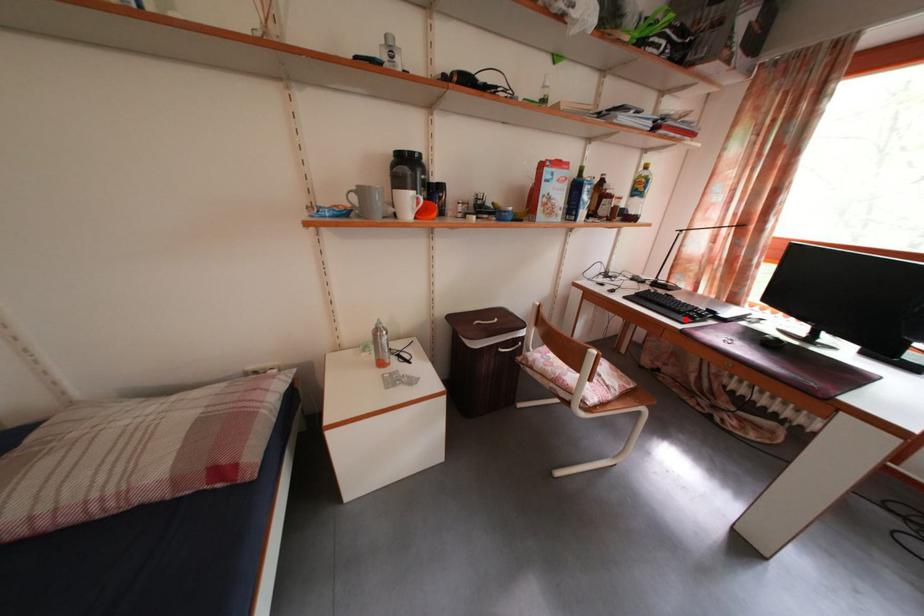
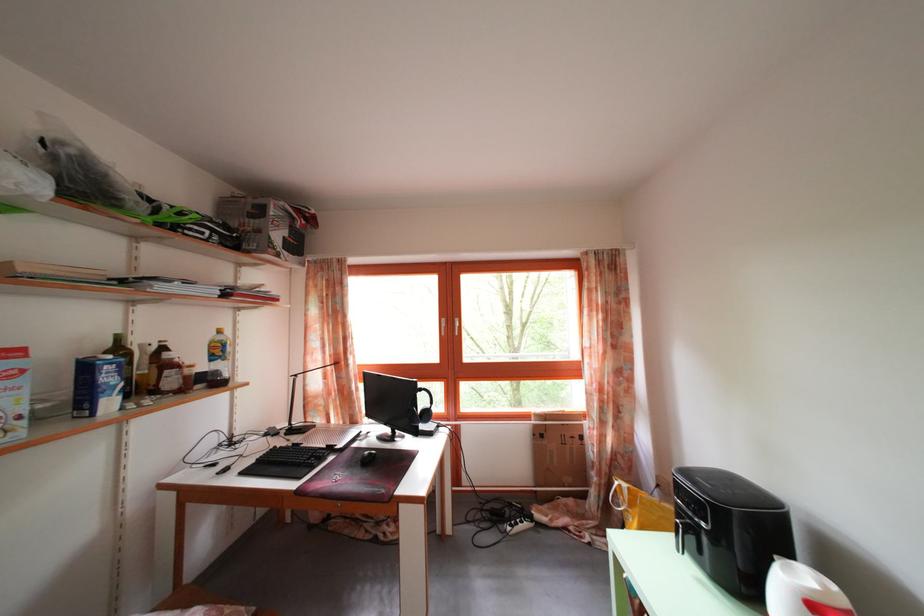
Where in the second image is the point corresponding to the highlighted location from the first image?

(307, 472)